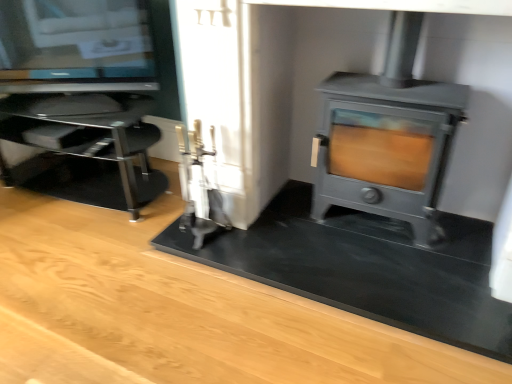
Question: Should I look upward or downward to see transparent glass tv stand at left?

Choices:
 (A) up
 (B) down

Answer: (A)

Question: From a real-world perspective, is matte gray wood burning stove at right physically above transparent glass tv stand at left?

Choices:
 (A) yes
 (B) no

Answer: (A)

Question: Considering the relative sizes of matte gray wood burning stove at right and transparent glass tv stand at left in the image provided, is matte gray wood burning stove at right smaller than transparent glass tv stand at left?

Choices:
 (A) yes
 (B) no

Answer: (A)

Question: From the image's perspective, does matte gray wood burning stove at right appear lower than transparent glass tv stand at left?

Choices:
 (A) no
 (B) yes

Answer: (A)

Question: Is matte gray wood burning stove at right to the right of transparent glass tv stand at left from the viewer's perspective?

Choices:
 (A) no
 (B) yes

Answer: (B)

Question: Is matte gray wood burning stove at right located outside transparent glass tv stand at left?

Choices:
 (A) yes
 (B) no

Answer: (A)

Question: From the image's perspective, would you say matte gray wood burning stove at right is positioned over transparent glass tv stand at left?

Choices:
 (A) no
 (B) yes

Answer: (B)

Question: Is there a large distance between transparent glass tv stand at left and matte gray wood burning stove at right?

Choices:
 (A) no
 (B) yes

Answer: (B)

Question: Is transparent glass tv stand at left closer to camera compared to matte gray wood burning stove at right?

Choices:
 (A) no
 (B) yes

Answer: (A)

Question: Can we say transparent glass tv stand at left lies outside matte gray wood burning stove at right?

Choices:
 (A) yes
 (B) no

Answer: (A)

Question: From the image's perspective, is transparent glass tv stand at left under matte gray wood burning stove at right?

Choices:
 (A) yes
 (B) no

Answer: (A)

Question: Is the surface of transparent glass tv stand at left in direct contact with matte gray wood burning stove at right?

Choices:
 (A) no
 (B) yes

Answer: (A)

Question: From a real-world perspective, is transparent glass tv stand at left beneath matte gray wood burning stove at right?

Choices:
 (A) yes
 (B) no

Answer: (A)

Question: From a real-world perspective, is matte gray wood burning stove at right physically located above or below transparent glass tv stand at left?

Choices:
 (A) above
 (B) below

Answer: (A)